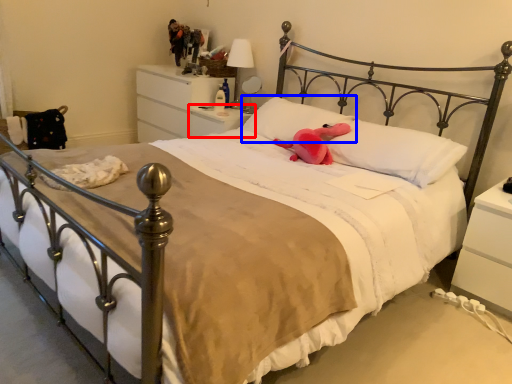
Question: Which object is closer to the camera taking this photo, nightstand (highlighted by a red box) or pillow (highlighted by a blue box)?

Choices:
 (A) nightstand
 (B) pillow

Answer: (B)